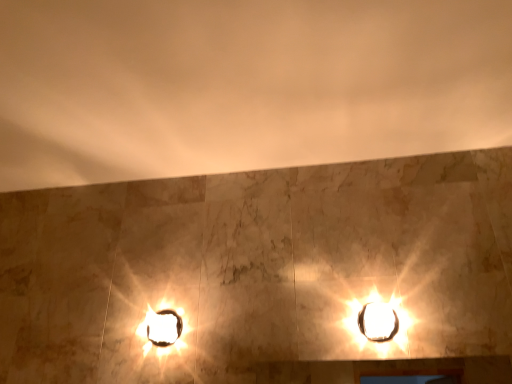
Question: Considering the relative positions of white glossy stage light at lower left and matte glass lamp at upper right in the image provided, is white glossy stage light at lower left to the left or to the right of matte glass lamp at upper right?

Choices:
 (A) right
 (B) left

Answer: (B)

Question: In terms of height, does white glossy stage light at lower left look taller or shorter compared to matte glass lamp at upper right?

Choices:
 (A) tall
 (B) short

Answer: (B)

Question: Is white glossy stage light at lower left inside the boundaries of matte glass lamp at upper right, or outside?

Choices:
 (A) inside
 (B) outside

Answer: (B)

Question: In the image, is matte glass lamp at upper right positioned in front of or behind white glossy stage light at lower left?

Choices:
 (A) behind
 (B) front

Answer: (B)

Question: From the image's perspective, is matte glass lamp at upper right above or below white glossy stage light at lower left?

Choices:
 (A) above
 (B) below

Answer: (A)

Question: Is matte glass lamp at upper right taller or shorter than white glossy stage light at lower left?

Choices:
 (A) short
 (B) tall

Answer: (B)

Question: From a real-world perspective, relative to white glossy stage light at lower left, is matte glass lamp at upper right vertically above or below?

Choices:
 (A) above
 (B) below

Answer: (A)